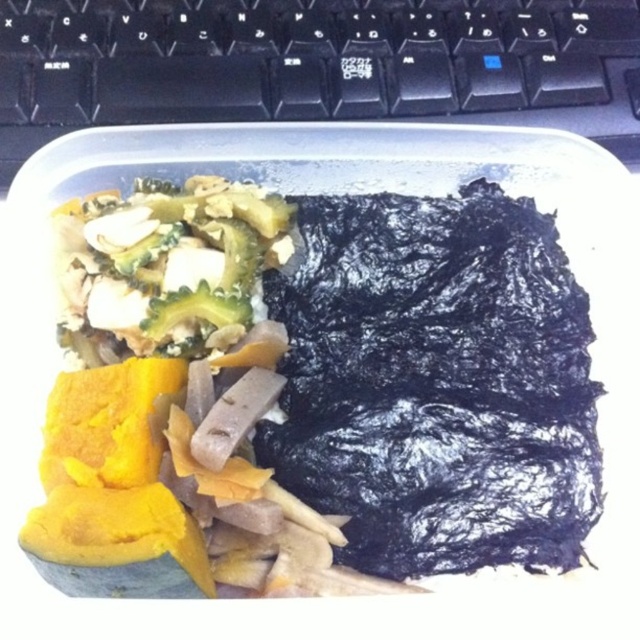
Question: Is dark purple seaweed at upper right closer to the viewer compared to black plastic keyboard at upper center?

Choices:
 (A) no
 (B) yes

Answer: (B)

Question: Can you confirm if dark purple seaweed at upper right is smaller than black plastic keyboard at upper center?

Choices:
 (A) yes
 (B) no

Answer: (B)

Question: Can you confirm if dark purple seaweed at upper right is positioned below black plastic keyboard at upper center?

Choices:
 (A) yes
 (B) no

Answer: (A)

Question: Which of the following is the closest to the observer?

Choices:
 (A) black plastic keyboard at upper center
 (B) dark purple seaweed at upper right

Answer: (B)

Question: Which point is closer to the camera?

Choices:
 (A) dark purple seaweed at upper right
 (B) black plastic keyboard at upper center

Answer: (A)